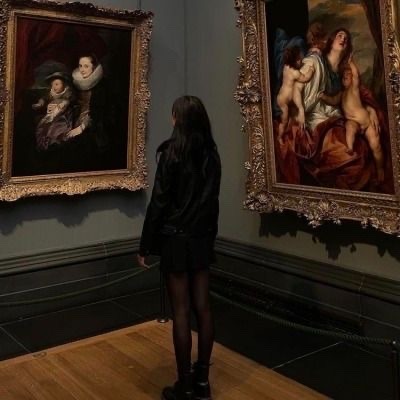
At what (x,y) coordinates should I click in order to perform the action: click on brown wood floor. Please return your answer as a coordinate pair (x, y). The image size is (400, 400). Looking at the image, I should click on pos(255,385).